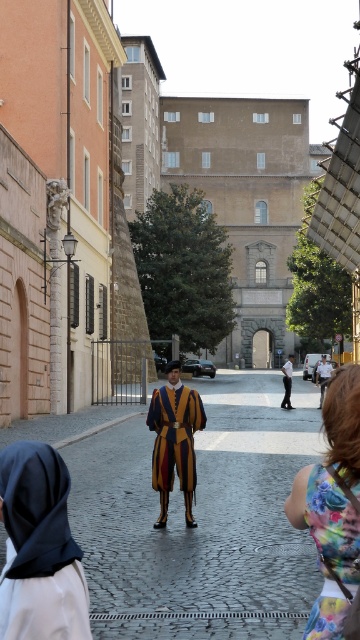
What are the coordinates of the matte yellow and blue striped uniform at center?

The coordinates of the matte yellow and blue striped uniform at center are at point (200,520).

You are a photographer planning to take a group photo of the matte yellow and blue striped uniform at center and the velvet yellow and purple robe at center. Which of the two should be placed in the front row to ensure both are visible in the photo?

The matte yellow and blue striped uniform at center should be placed in the front row because it has a lesser height compared to the velvet yellow and purple robe at center, allowing both to be visible in the photo.